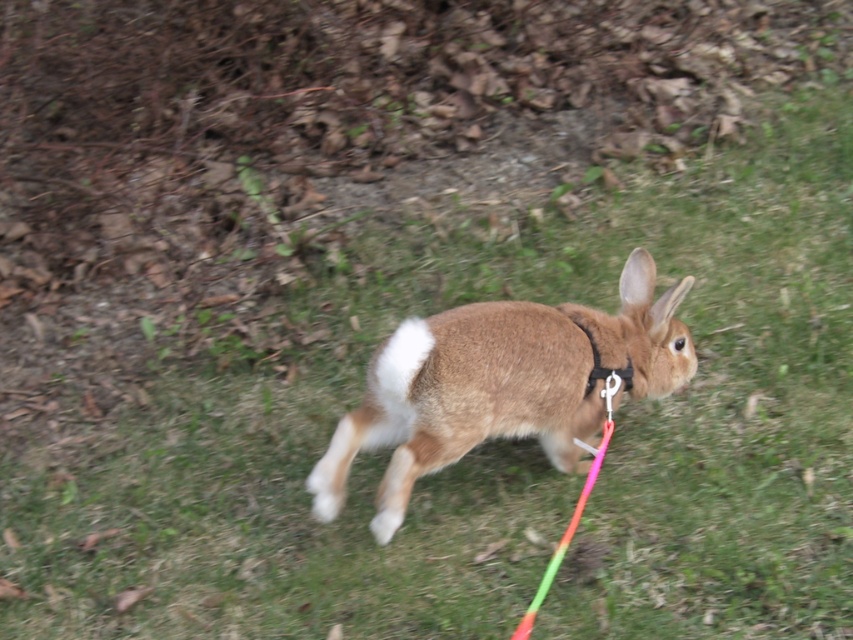
Which is below, brown furry rabbit at center or black fabric neckband at center?

brown furry rabbit at center is lower down.

Does brown furry rabbit at center have a larger size compared to black fabric neckband at center?

Yes, brown furry rabbit at center is bigger than black fabric neckband at center.

Which is in front, point (601, 355) or point (590, 374)?

Point (590, 374) is in front.

Where is `brown furry rabbit at center`? The height and width of the screenshot is (640, 853). brown furry rabbit at center is located at coordinates (502, 385).